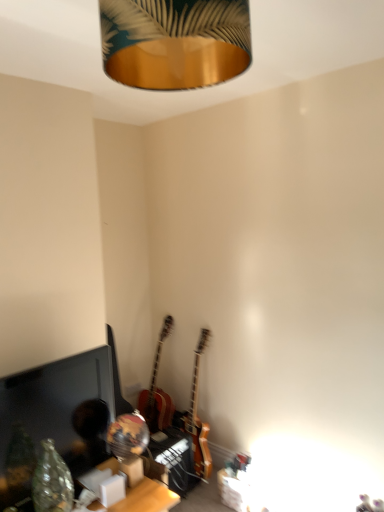
Question: Is gold metallic lampshade at upper center spatially inside matte black monitor at lower left, or outside of it?

Choices:
 (A) outside
 (B) inside

Answer: (A)

Question: Considering their positions, is gold metallic lampshade at upper center located in front of or behind matte black monitor at lower left?

Choices:
 (A) front
 (B) behind

Answer: (A)

Question: Estimate the real-world distances between objects in this image. Which object is farther from the wooden table at lower center?

Choices:
 (A) matte black monitor at lower left
 (B) gold metallic lampshade at upper center
 (C) wooden acoustic guitar at center, the first guitar viewed from the left
 (D) wooden electric guitar at center, the 1th guitar positioned from the right

Answer: (B)

Question: Which object is the closest to the matte black monitor at lower left?

Choices:
 (A) gold metallic lampshade at upper center
 (B) wooden acoustic guitar at center, which is counted as the second guitar, starting from the right
 (C) wooden electric guitar at center, the 1th guitar positioned from the right
 (D) wooden table at lower center

Answer: (D)